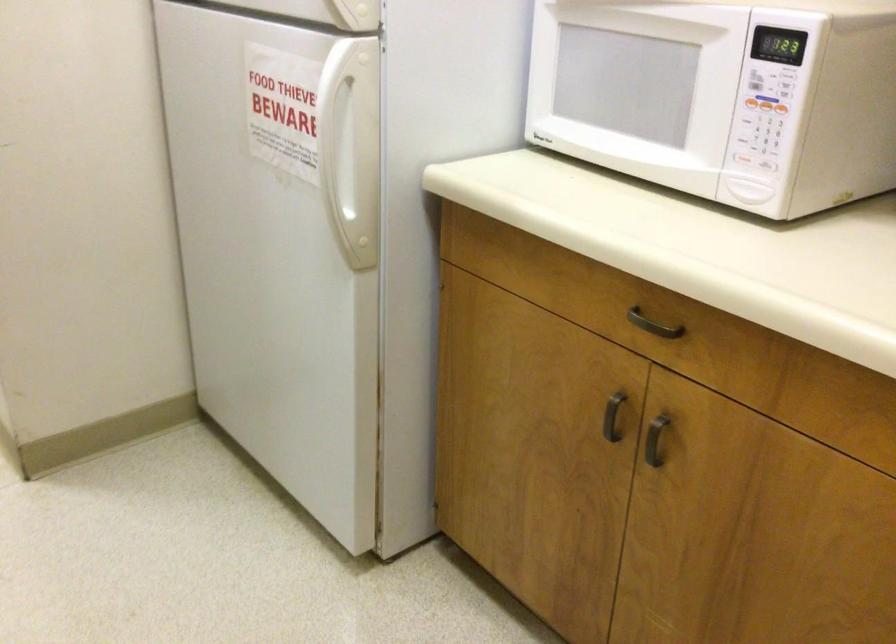
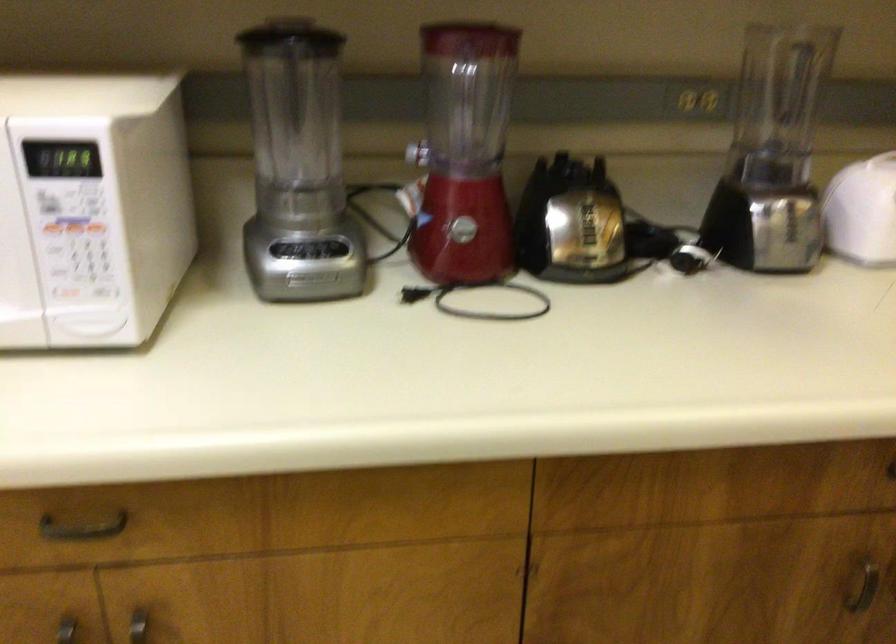
Where in the second image is the point corresponding to (658,323) from the first image?

(82, 527)